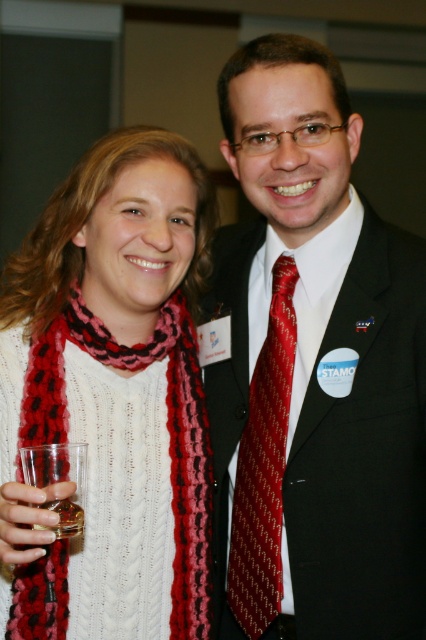
Question: Is knitted wool scarf at left closer to camera compared to translucent glass at lower left?

Choices:
 (A) yes
 (B) no

Answer: (B)

Question: Is shiny red tie at center positioned at the back of translucent glass at lower left?

Choices:
 (A) no
 (B) yes

Answer: (B)

Question: Which of the following is the closest to the observer?

Choices:
 (A) (57, 624)
 (B) (354, 129)

Answer: (A)

Question: Which point is closer to the camera taking this photo?

Choices:
 (A) (170, 435)
 (B) (80, 481)

Answer: (B)

Question: Which object is farther from the camera taking this photo?

Choices:
 (A) shiny silk tie at center
 (B) translucent glass at lower left

Answer: (A)

Question: Is shiny silk tie at center above translucent glass at lower left?

Choices:
 (A) yes
 (B) no

Answer: (A)